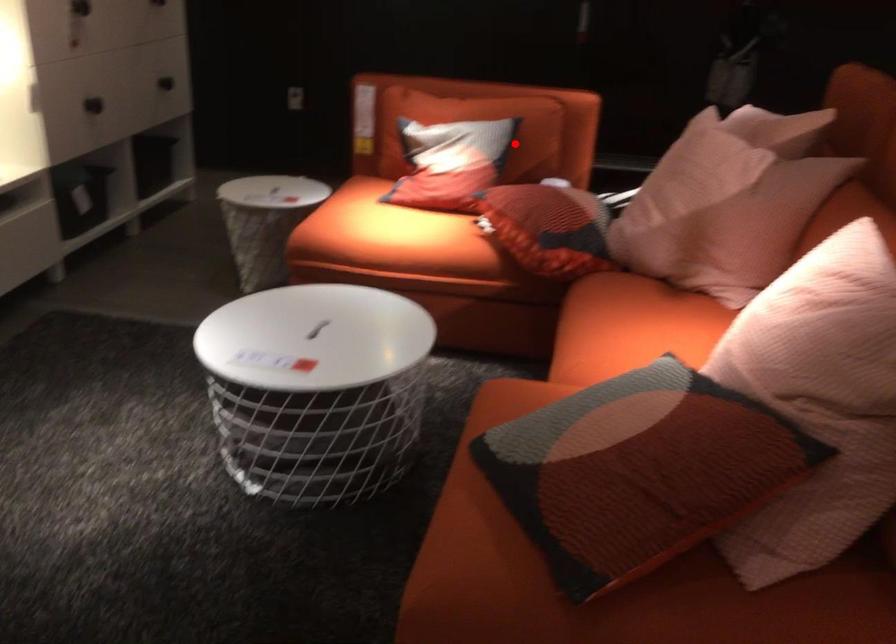
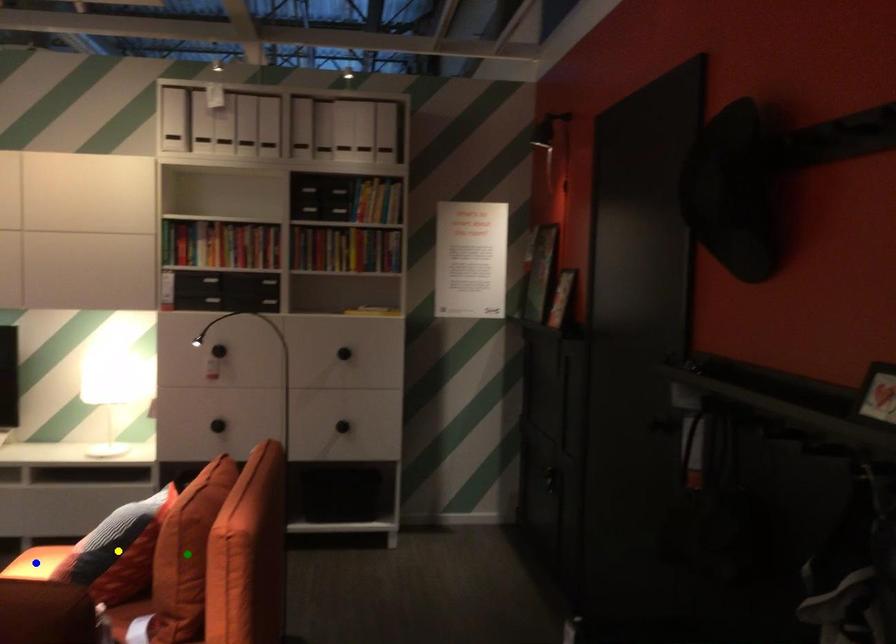
Question: I am providing you with two images of the same scene from different viewpoints. A red point is marked on the first image. You are given multiple points on the second image. In image 2, which mark is for the same physical point as the one in image 1?

Choices:
 (A) green point
 (B) blue point
 (C) yellow point

Answer: (C)